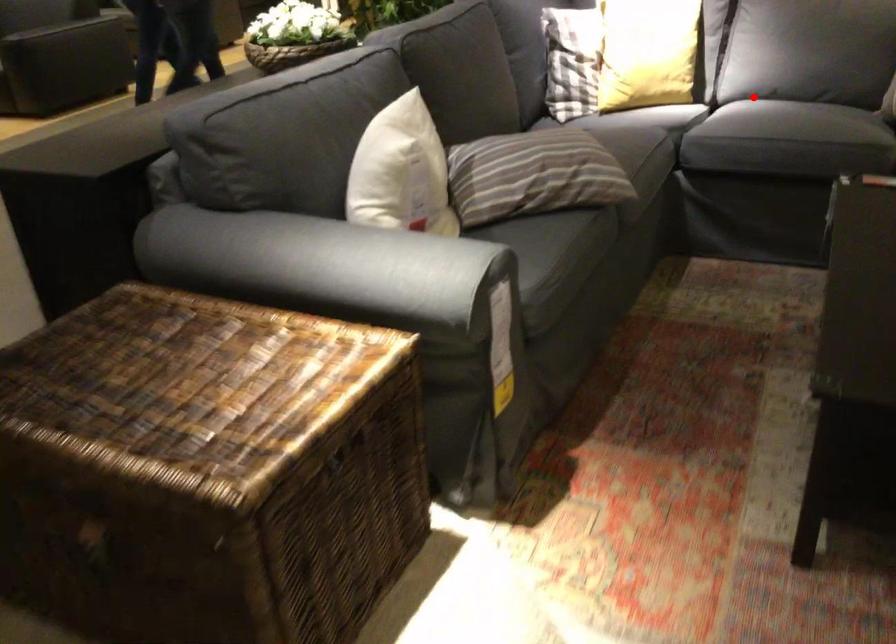
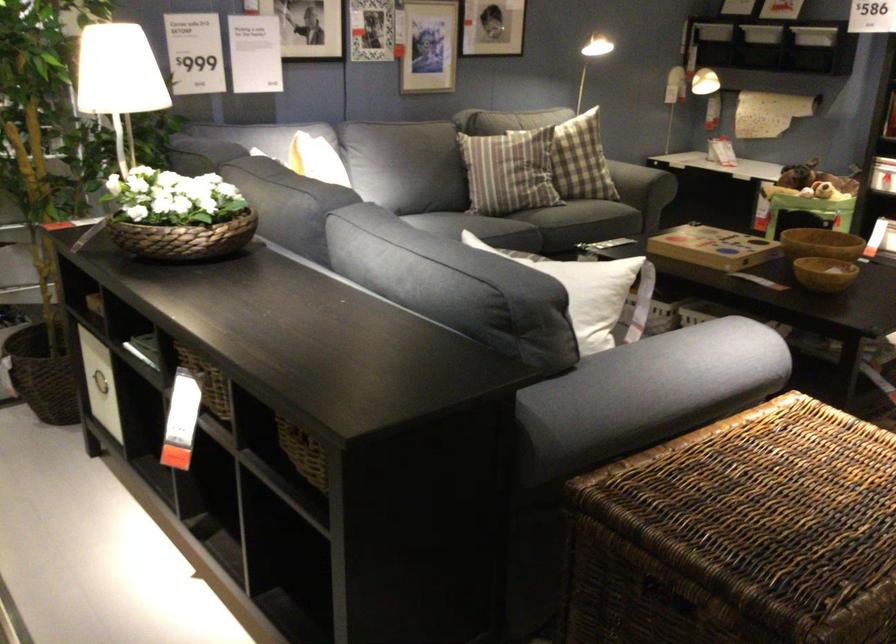
Question: I am providing you with two images of the same scene from different viewpoints. In image1, a red point is highlighted. Considering the same 3D point in image2, which of the following is correct?

Choices:
 (A) It is closer
 (B) It is farther

Answer: (B)